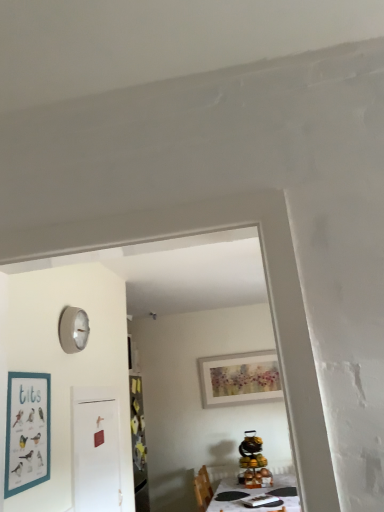
In order to click on free space above watercolor paper picture frame at upper center, arranged as the 1th picture frame when viewed from the right (from a real-world perspective) in this screenshot , I will do `click(243, 353)`.